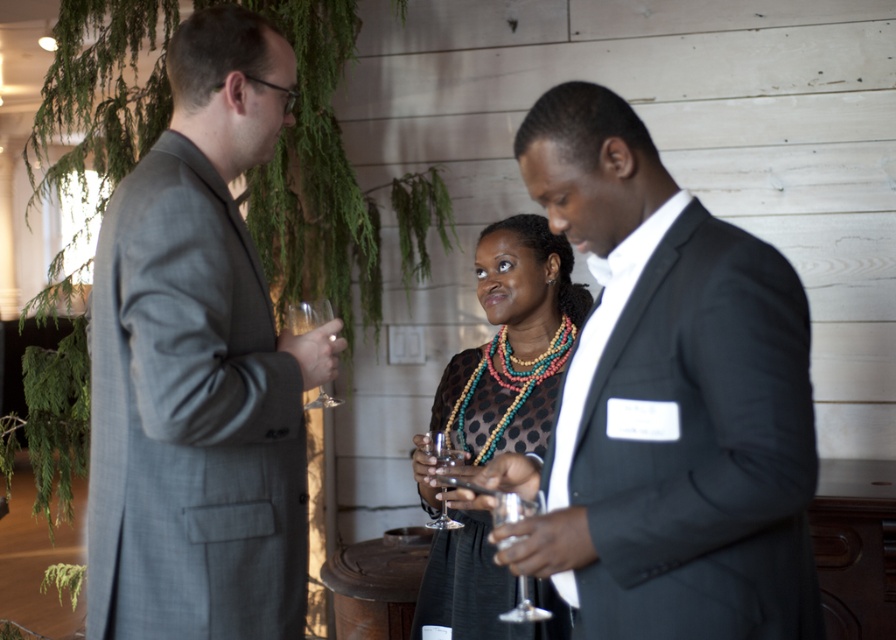
Is point (634, 632) behind point (317, 310)?

No, it is in front of (317, 310).

Can you confirm if matte black suit at center is thinner than clear glass wine glass at center?

No, matte black suit at center is not thinner than clear glass wine glass at center.

Does point (658, 195) come farther from viewer compared to point (316, 397)?

No.

Where is `matte black suit at center`? matte black suit at center is located at coordinates (666, 401).

In the scene shown: Is black dotted dress at center to the left of clear glass wine glass at center from the viewer's perspective?

In fact, black dotted dress at center is to the right of clear glass wine glass at center.

Where is `black dotted dress at center`? This screenshot has width=896, height=640. black dotted dress at center is located at coordinates (513, 340).

Is the position of matte black suit at center less distant than that of black dotted dress at center?

Yes, matte black suit at center is closer to the viewer.

Who is positioned more to the left, matte black suit at center or black dotted dress at center?

black dotted dress at center is more to the left.

Where is `matte black suit at center`? This screenshot has height=640, width=896. matte black suit at center is located at coordinates (666, 401).